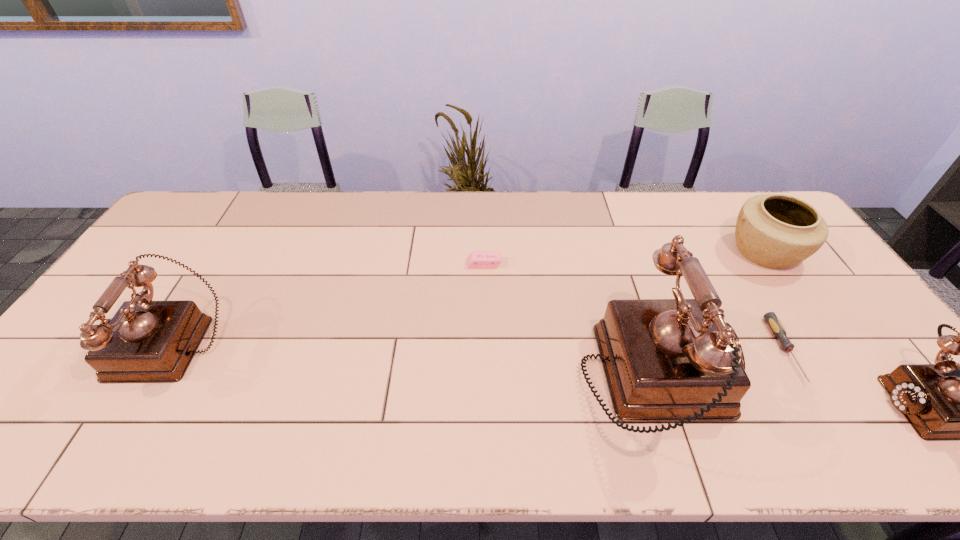
To make them evenly spaced by inserting another telephone among them, please locate a free space for this new telephone. Please provide its 2D coordinates. Your answer should be formatted as a tuple, i.e. [(x, y)], where the tuple contains the x and y coordinates of a point satisfying the conditions above.

[(404, 360)]